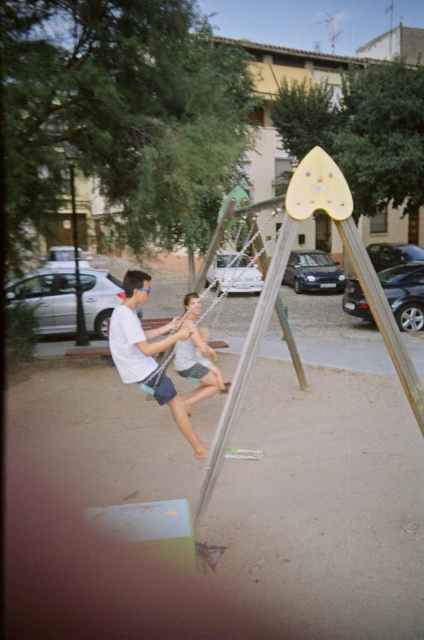
Question: Does light blue denim shorts at center appear under brushed metal pole at left?

Choices:
 (A) yes
 (B) no

Answer: (A)

Question: Among these points, which one is farthest from the camera?

Choices:
 (A) (130, 308)
 (B) (81, 323)

Answer: (B)

Question: Can you confirm if light blue denim shorts at center is positioned to the left of brushed metal pole at left?

Choices:
 (A) no
 (B) yes

Answer: (A)

Question: Considering the real-world distances, which object is closest to the light blue denim shorts at center?

Choices:
 (A) wooden swing at center
 (B) white cotton shirt at center

Answer: (B)

Question: Which point is closer to the camera?

Choices:
 (A) click(x=261, y=205)
 (B) click(x=75, y=344)
 (C) click(x=198, y=368)
 (D) click(x=147, y=348)

Answer: (D)

Question: Is white cotton shirt at center below wooden swing at center?

Choices:
 (A) no
 (B) yes

Answer: (B)